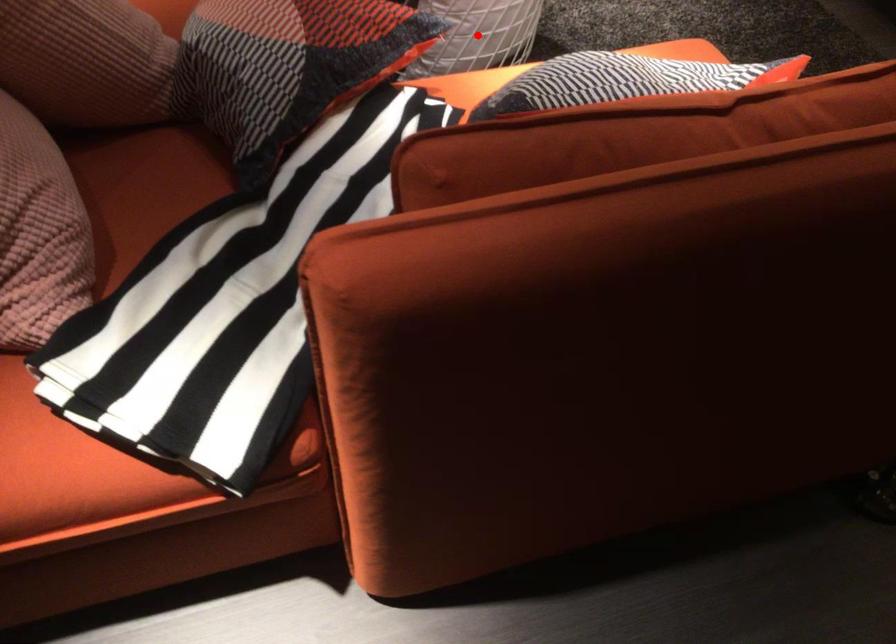
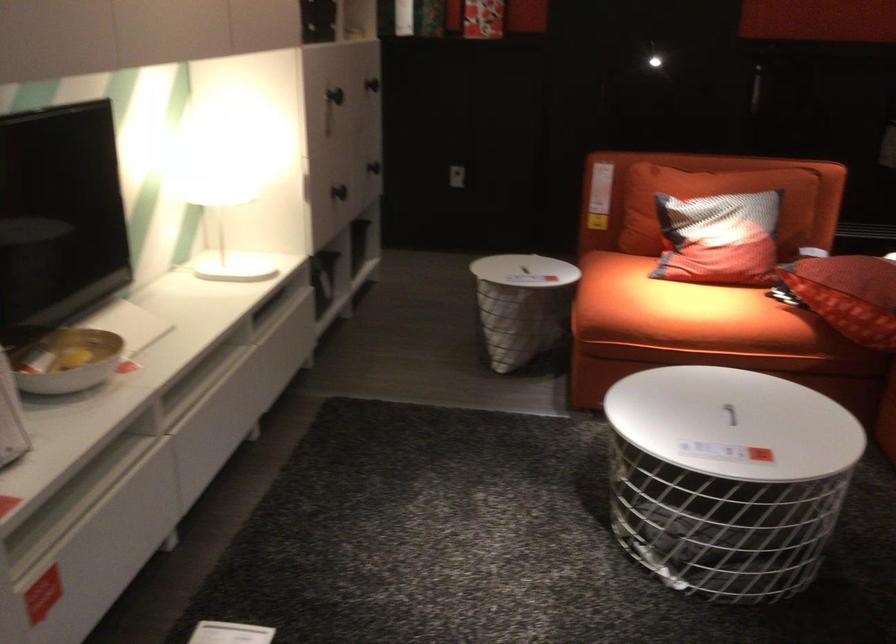
Question: I am providing you with two images of the same scene from different viewpoints. A red point is marked on the first image. At the location where the point appears in image 1, is it still visible in image 2?

Choices:
 (A) Yes
 (B) No

Answer: (B)